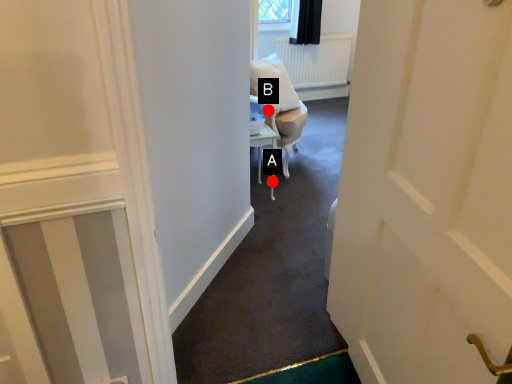
Question: Two points are circled on the image, labeled by A and B beside each circle. Which point appears farthest from the camera in this image?

Choices:
 (A) A is further
 (B) B is further

Answer: (A)